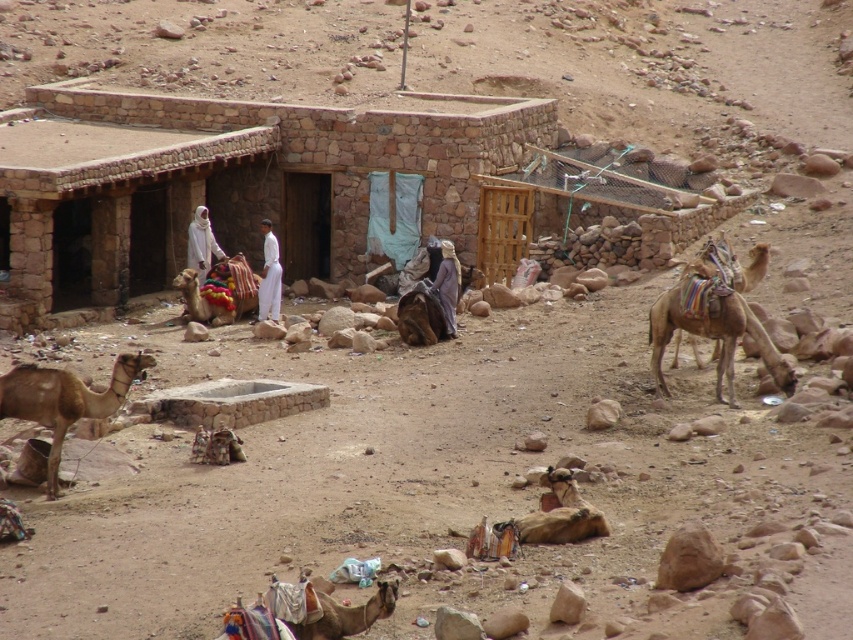
Can you confirm if brown matte camel at lower left is wider than brown textured robe at center?

Correct, the width of brown matte camel at lower left exceeds that of brown textured robe at center.

Is brown matte camel at lower left to the left of brown textured robe at center from the viewer's perspective?

Correct, you'll find brown matte camel at lower left to the left of brown textured robe at center.

Is point (59, 454) positioned before point (450, 288)?

That is True.

Identify the location of brown matte camel at lower left. The width and height of the screenshot is (853, 640). (64, 401).

Is brown textured camel at right to the left of white clothed person at center from the viewer's perspective?

No, brown textured camel at right is not to the left of white clothed person at center.

Can you confirm if brown textured camel at right is smaller than white clothed person at center?

Actually, brown textured camel at right might be larger than white clothed person at center.

What do you see at coordinates (711, 323) in the screenshot? I see `brown textured camel at right` at bounding box center [711, 323].

Where is `brown textured camel at right`? brown textured camel at right is located at coordinates (711, 323).

Which of these two, multicolored fabric camel at lower center or brown textured robe at center, stands taller?

With more height is brown textured robe at center.

Is multicolored fabric camel at lower center thinner than brown textured robe at center?

No, multicolored fabric camel at lower center is not thinner than brown textured robe at center.

Describe the element at coordinates (346, 614) in the screenshot. This screenshot has width=853, height=640. I see `multicolored fabric camel at lower center` at that location.

Identify the location of multicolored fabric camel at lower center. The image size is (853, 640). (346, 614).